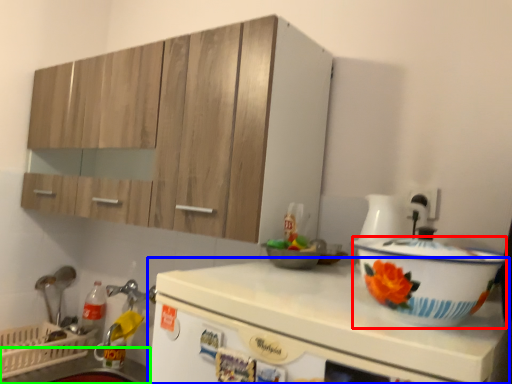
Question: Considering the real-world distances, which object is farthest from basin (highlighted by a red box)? countertop (highlighted by a blue box) or counter top (highlighted by a green box)?

Choices:
 (A) countertop
 (B) counter top

Answer: (B)